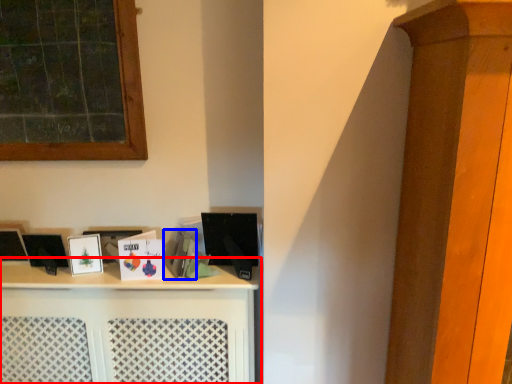
Question: Which of the following is the closest to the observer, shelf (highlighted by a red box) or book (highlighted by a blue box)?

Choices:
 (A) shelf
 (B) book

Answer: (A)